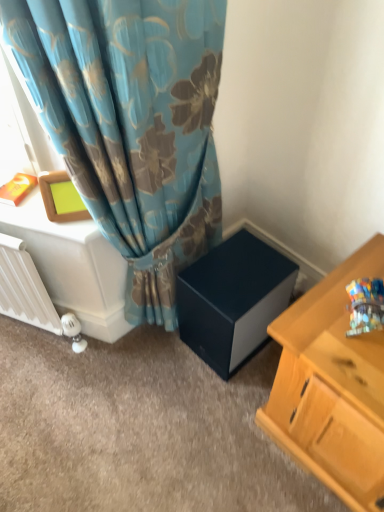
Find the location of a particular element. The image size is (384, 512). free point in front of white matte radiator at lower left is located at coordinates (44, 380).